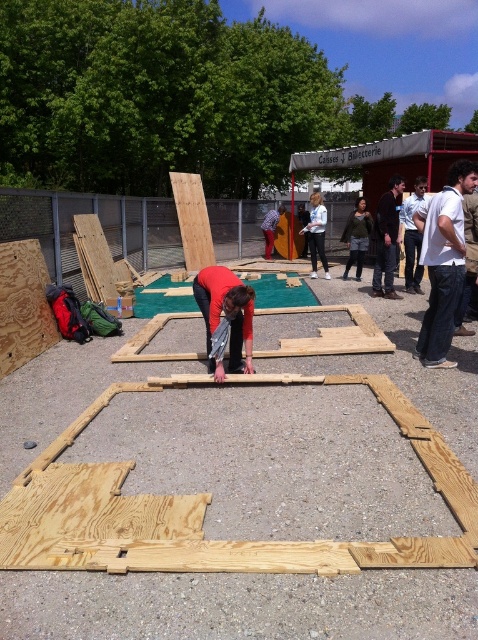
Question: Among these objects, which one is farthest from the camera?

Choices:
 (A) white shirt at center
 (B) denim jacket at center
 (C) plywood at left
 (D) natural wood frame at center

Answer: (B)

Question: Which of these objects is positioned closest to the white shirt at center?

Choices:
 (A) light blue shirt at center
 (B) denim jacket at center
 (C) natural wood frame at center

Answer: (B)

Question: Which object is farther from the camera taking this photo?

Choices:
 (A) white cotton shirt at center
 (B) white shirt at center

Answer: (B)

Question: Is red shirt at center to the right of white shirt at center from the viewer's perspective?

Choices:
 (A) no
 (B) yes

Answer: (A)

Question: Does black cotton shirt at center appear under white shirt at center?

Choices:
 (A) yes
 (B) no

Answer: (A)

Question: Can you confirm if natural wood frame at center is smaller than black cotton shirt at center?

Choices:
 (A) no
 (B) yes

Answer: (A)